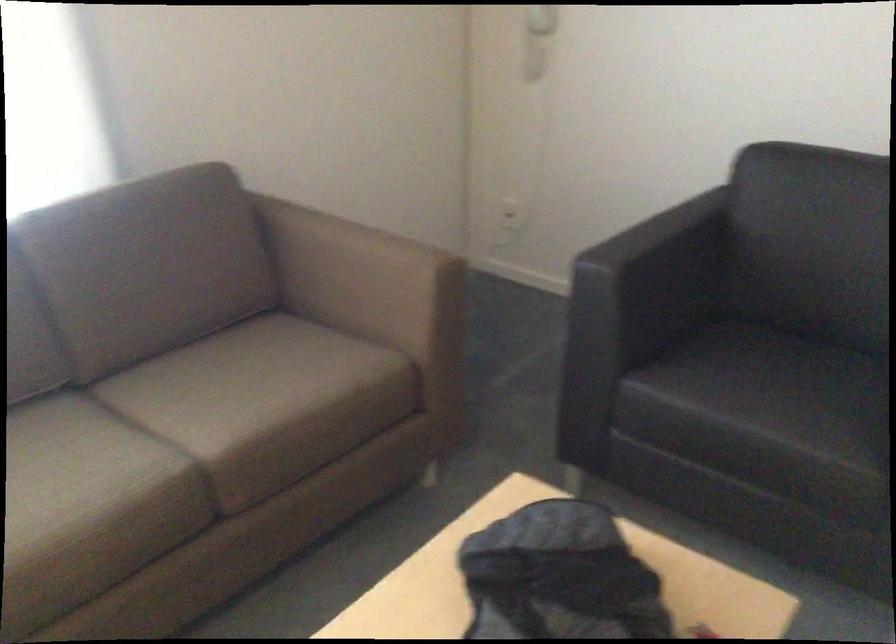
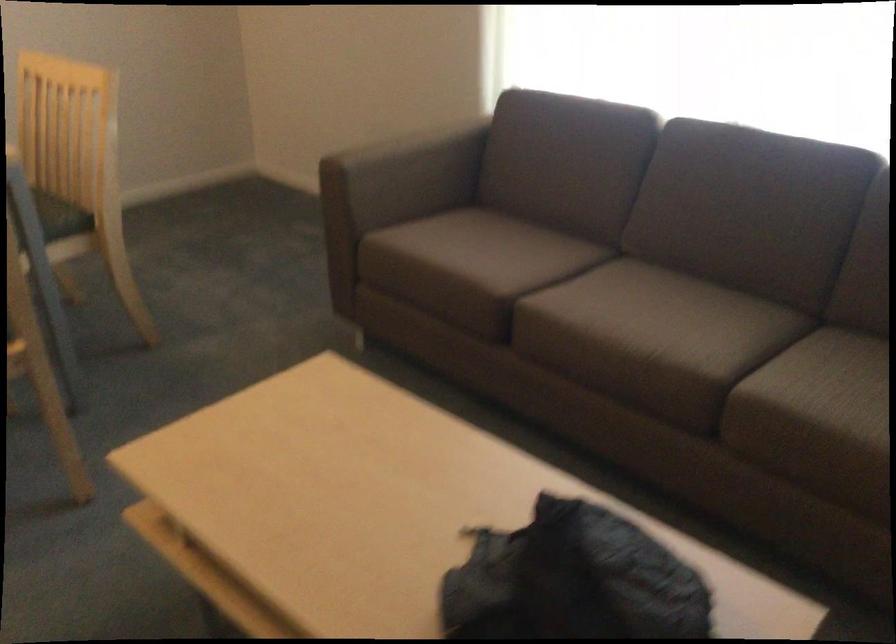
The point at (191, 444) is marked in the first image. Where is the corresponding point in the second image?

(726, 368)